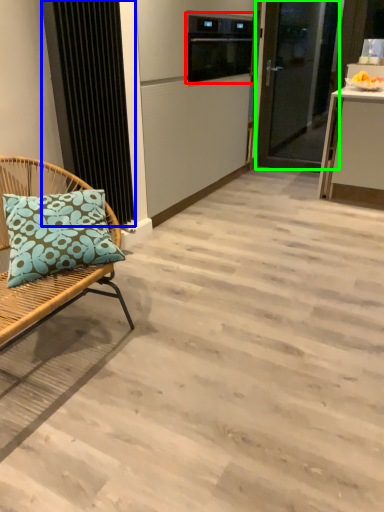
Question: Which object is positioned closest to appliance (highlighted by a red box)? Select from radiator (highlighted by a blue box) and door (highlighted by a green box).

Choices:
 (A) radiator
 (B) door

Answer: (B)